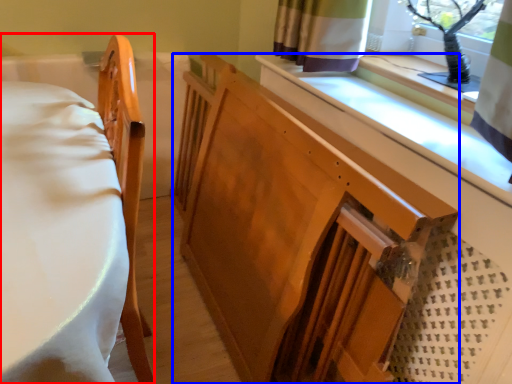
Question: Which point is further to the camera, furniture (highlighted by a red box) or changing table (highlighted by a blue box)?

Choices:
 (A) furniture
 (B) changing table

Answer: (B)